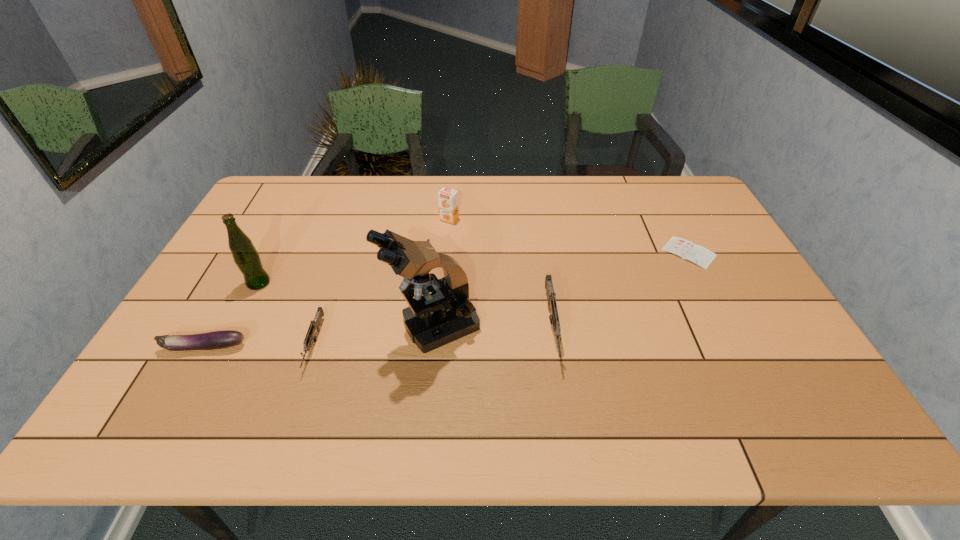
I want to click on free space at the near edge of the desktop, so click(714, 367).

In the image, there is a desktop. Where is `vacant space at the right edge`? vacant space at the right edge is located at coordinates (685, 222).

In the image, there is a desktop. In order to click on vacant space at the near right corner in this screenshot , I will do `click(760, 365)`.

At what (x,y) coordinates should I click in order to perform the action: click on vacant space that's between the orange juice and the sixth tallest object. Please return your answer as a coordinate pair (x, y). This screenshot has height=540, width=960. Looking at the image, I should click on (326, 283).

I want to click on free space between the beer bottle and the second shortest object, so click(231, 315).

Where is `free space between the rightmost object and the second object from right to left`? This screenshot has width=960, height=540. free space between the rightmost object and the second object from right to left is located at coordinates (620, 290).

At what (x,y) coordinates should I click in order to perform the action: click on free spot between the shortest object and the left gun. Please return your answer as a coordinate pair (x, y). This screenshot has height=540, width=960. Looking at the image, I should click on (502, 299).

Identify the location of free area in between the second shortest object and the orange juice. (326, 283).

Image resolution: width=960 pixels, height=540 pixels. What are the coordinates of `empty space between the orange juice and the second shortest object` in the screenshot? It's located at click(x=326, y=283).

Identify the location of free space between the left gun and the eggplant. The image size is (960, 540). (259, 346).